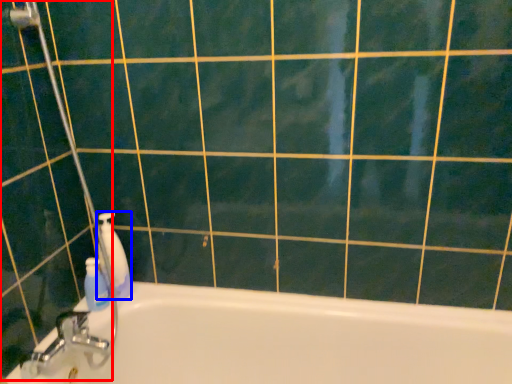
Question: Which object is further to the camera taking this photo, shower door (highlighted by a red box) or cleaning product (highlighted by a blue box)?

Choices:
 (A) shower door
 (B) cleaning product

Answer: (B)